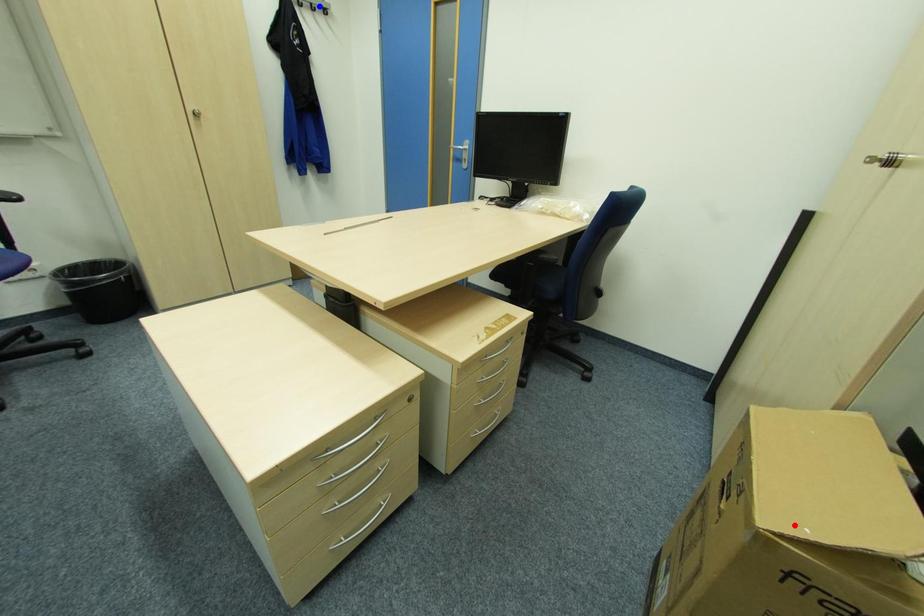
Question: Two points are marked on the image. Which point is closer to the camera?

Choices:
 (A) Blue point is closer.
 (B) Red point is closer.

Answer: (B)